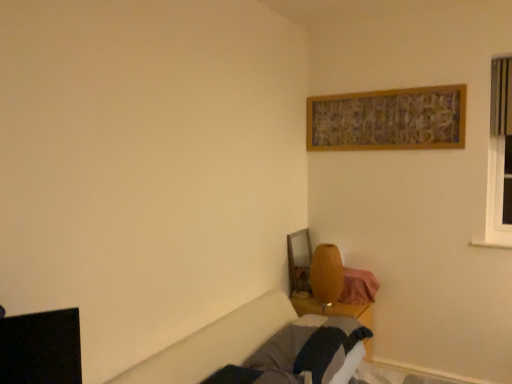
Question: Is matte yellow vase at lower center bigger or smaller than wooden bed frame at lower right?

Choices:
 (A) small
 (B) big

Answer: (A)

Question: Considering the positions of matte yellow vase at lower center and wooden bed frame at lower right in the image, is matte yellow vase at lower center taller or shorter than wooden bed frame at lower right?

Choices:
 (A) short
 (B) tall

Answer: (B)

Question: Is matte yellow vase at lower center inside or outside of wooden bed frame at lower right?

Choices:
 (A) inside
 (B) outside

Answer: (B)

Question: Looking at their shapes, would you say wooden bed frame at lower right is wider or thinner than matte yellow vase at lower center?

Choices:
 (A) wide
 (B) thin

Answer: (A)

Question: From the image's perspective, is wooden bed frame at lower right located above or below matte yellow vase at lower center?

Choices:
 (A) above
 (B) below

Answer: (B)

Question: From their relative heights in the image, would you say wooden bed frame at lower right is taller or shorter than matte yellow vase at lower center?

Choices:
 (A) tall
 (B) short

Answer: (B)

Question: From a real-world perspective, is wooden bed frame at lower right physically located above or below matte yellow vase at lower center?

Choices:
 (A) above
 (B) below

Answer: (B)